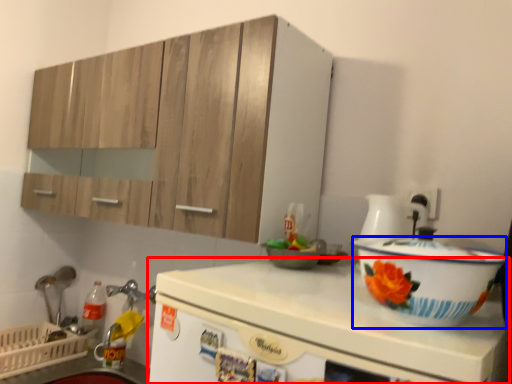
Question: Which object appears farthest to the camera in this image, countertop (highlighted by a red box) or basin (highlighted by a blue box)?

Choices:
 (A) countertop
 (B) basin

Answer: (B)